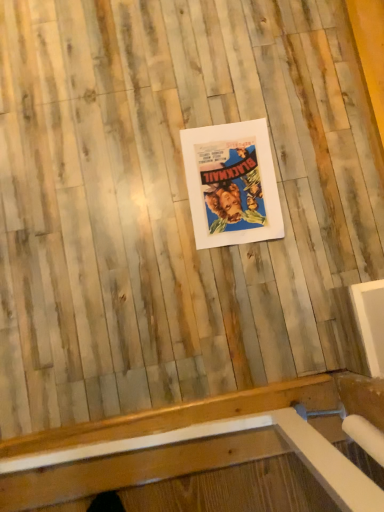
Locate an element on the screen. vacant region to the left of white matte picture frame at center is located at coordinates (138, 174).